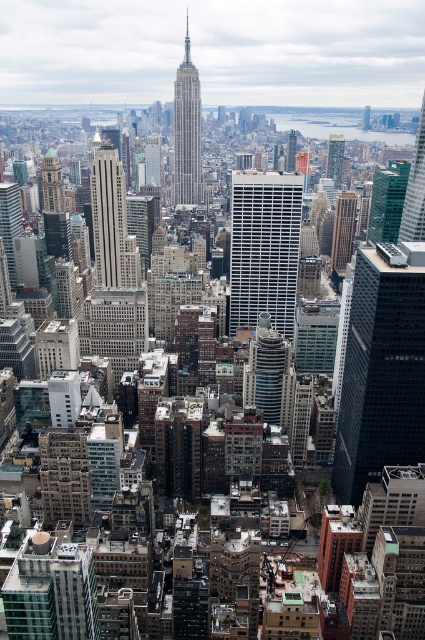
You are a city planner reviewing this aerial view of the city. You need to determine which of the two buildings, the silver metallic skyscraper at center or the brown brick building at center, has a higher elevation. Based on the image, which one is taller?

The silver metallic skyscraper at center is taller than the brown brick building at center, so it has a higher elevation.